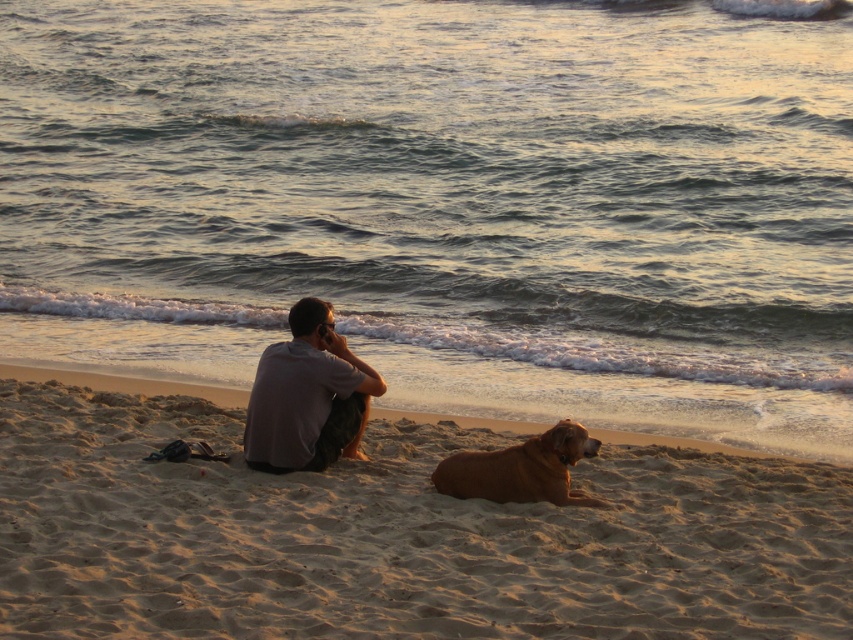
Question: Can you confirm if sandy shore at lower center is thinner than golden fur dog at lower center?

Choices:
 (A) yes
 (B) no

Answer: (B)

Question: Is light gray cotton shirt at center positioned in front of golden fur dog at lower center?

Choices:
 (A) no
 (B) yes

Answer: (A)

Question: Which point appears farthest from the camera in this image?

Choices:
 (A) (328, 442)
 (B) (695, 440)
 (C) (538, 484)

Answer: (B)

Question: Which object is positioned farthest from the sandy yellow sand at center?

Choices:
 (A) golden fur dog at lower center
 (B) light gray cotton shirt at center

Answer: (B)

Question: Among these objects, which one is nearest to the camera?

Choices:
 (A) sandy yellow sand at center
 (B) golden fur dog at lower center
 (C) sandy shore at lower center
 (D) light gray cotton shirt at center

Answer: (A)

Question: In this image, where is light gray cotton shirt at center located relative to sandy shore at lower center?

Choices:
 (A) below
 (B) above

Answer: (B)